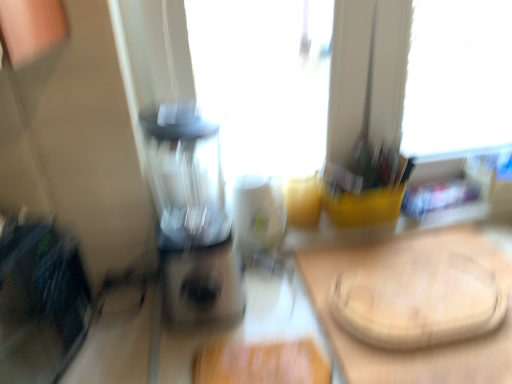
Question: Should I look upward or downward to see transparent plastic blender at center?

Choices:
 (A) up
 (B) down

Answer: (B)

Question: From a real-world perspective, is transparent plastic blender at center positioned under white glossy mug at center based on gravity?

Choices:
 (A) yes
 (B) no

Answer: (B)

Question: Considering the relative sizes of transparent plastic blender at center and white glossy mug at center in the image provided, is transparent plastic blender at center taller than white glossy mug at center?

Choices:
 (A) no
 (B) yes

Answer: (B)

Question: Is transparent plastic blender at center bigger than white glossy mug at center?

Choices:
 (A) yes
 (B) no

Answer: (A)

Question: Is transparent plastic blender at center far from white glossy mug at center?

Choices:
 (A) no
 (B) yes

Answer: (A)

Question: Is the depth of transparent plastic blender at center less than that of white glossy mug at center?

Choices:
 (A) yes
 (B) no

Answer: (A)

Question: Could you tell me if transparent plastic blender at center is turned towards white glossy mug at center?

Choices:
 (A) yes
 (B) no

Answer: (B)

Question: Is wooden cutting board at center located outside transparent plastic blender at center?

Choices:
 (A) no
 (B) yes

Answer: (B)

Question: Is wooden cutting board at center further to camera compared to transparent plastic blender at center?

Choices:
 (A) yes
 (B) no

Answer: (A)

Question: Is wooden cutting board at center facing towards transparent plastic blender at center?

Choices:
 (A) no
 (B) yes

Answer: (A)

Question: Considering the relative positions of wooden cutting board at center and transparent plastic blender at center in the image provided, is wooden cutting board at center to the left of transparent plastic blender at center from the viewer's perspective?

Choices:
 (A) no
 (B) yes

Answer: (A)

Question: Considering the relative sizes of wooden cutting board at center and transparent plastic blender at center in the image provided, is wooden cutting board at center thinner than transparent plastic blender at center?

Choices:
 (A) no
 (B) yes

Answer: (A)

Question: Is transparent plastic blender at center at the back of wooden cutting board at center?

Choices:
 (A) no
 (B) yes

Answer: (A)

Question: Is white glossy mug at center next to transparent plastic blender at center and touching it?

Choices:
 (A) no
 (B) yes

Answer: (A)